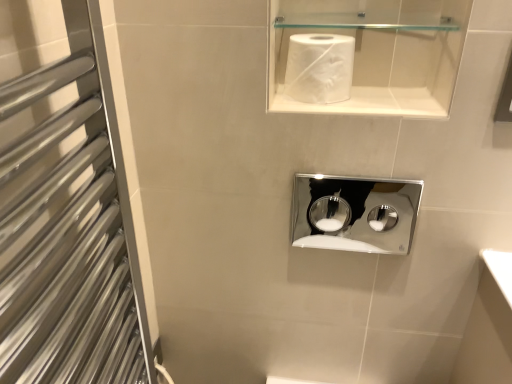
Question: Is chrome/metallic medicine cabinet at center at the left side of silver metallic towel rack at left?

Choices:
 (A) yes
 (B) no

Answer: (B)

Question: Does chrome/metallic medicine cabinet at center have a smaller size compared to silver metallic towel rack at left?

Choices:
 (A) no
 (B) yes

Answer: (B)

Question: Is chrome/metallic medicine cabinet at center thinner than silver metallic towel rack at left?

Choices:
 (A) no
 (B) yes

Answer: (B)

Question: Is the depth of chrome/metallic medicine cabinet at center greater than that of silver metallic towel rack at left?

Choices:
 (A) no
 (B) yes

Answer: (B)

Question: From the image's perspective, would you say chrome/metallic medicine cabinet at center is positioned over silver metallic towel rack at left?

Choices:
 (A) no
 (B) yes

Answer: (B)

Question: From the image's perspective, is white matte paper towel at upper center located above or below chrome/metallic medicine cabinet at center?

Choices:
 (A) below
 (B) above

Answer: (B)

Question: Considering the positions of point (298, 97) and point (324, 180), is point (298, 97) closer or farther from the camera than point (324, 180)?

Choices:
 (A) closer
 (B) farther

Answer: (A)

Question: Is white matte paper towel at upper center to the left or to the right of chrome/metallic medicine cabinet at center in the image?

Choices:
 (A) left
 (B) right

Answer: (A)

Question: Is white matte paper towel at upper center wider or thinner than chrome/metallic medicine cabinet at center?

Choices:
 (A) thin
 (B) wide

Answer: (B)

Question: Considering the positions of point (352, 62) and point (19, 244), is point (352, 62) closer or farther from the camera than point (19, 244)?

Choices:
 (A) farther
 (B) closer

Answer: (A)

Question: Considering the positions of white matte paper towel at upper center and silver metallic towel rack at left in the image, is white matte paper towel at upper center bigger or smaller than silver metallic towel rack at left?

Choices:
 (A) big
 (B) small

Answer: (B)

Question: Relative to silver metallic towel rack at left, is white matte paper towel at upper center in front or behind?

Choices:
 (A) behind
 (B) front

Answer: (A)

Question: Considering the positions of white matte paper towel at upper center and silver metallic towel rack at left in the image, is white matte paper towel at upper center taller or shorter than silver metallic towel rack at left?

Choices:
 (A) short
 (B) tall

Answer: (A)

Question: Looking at the image, does chrome/metallic medicine cabinet at center seem bigger or smaller compared to white matte paper towel at upper center?

Choices:
 (A) big
 (B) small

Answer: (B)

Question: From a real-world perspective, is chrome/metallic medicine cabinet at center physically located above or below white matte paper towel at upper center?

Choices:
 (A) below
 (B) above

Answer: (A)